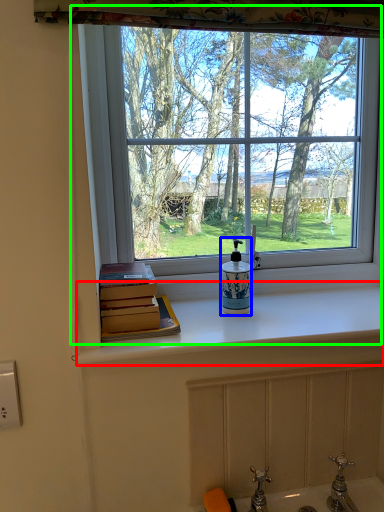
Question: Estimate the real-world distances between objects in this image. Which object is farther from counter top (highlighted by a red box), soap dispenser (highlighted by a blue box) or window (highlighted by a green box)?

Choices:
 (A) soap dispenser
 (B) window

Answer: (B)